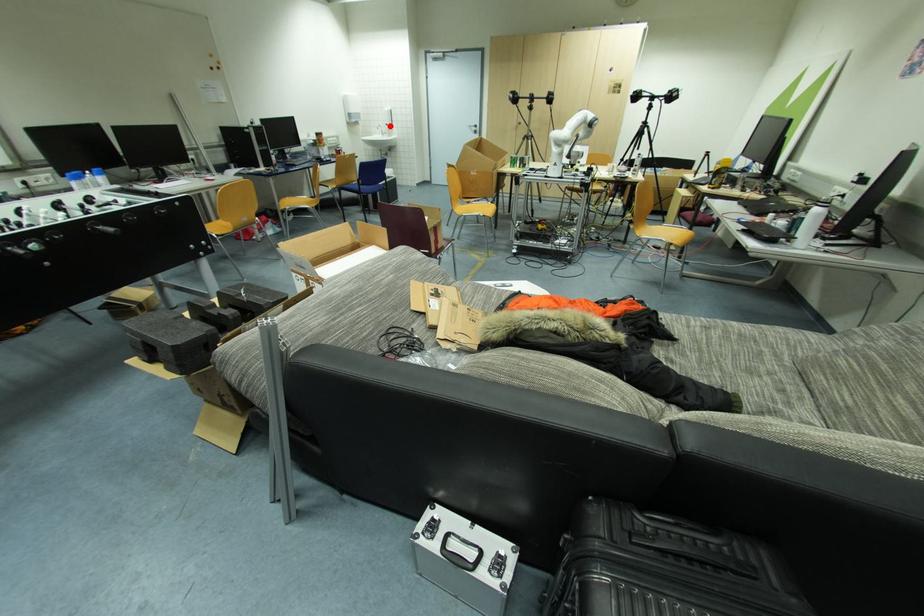
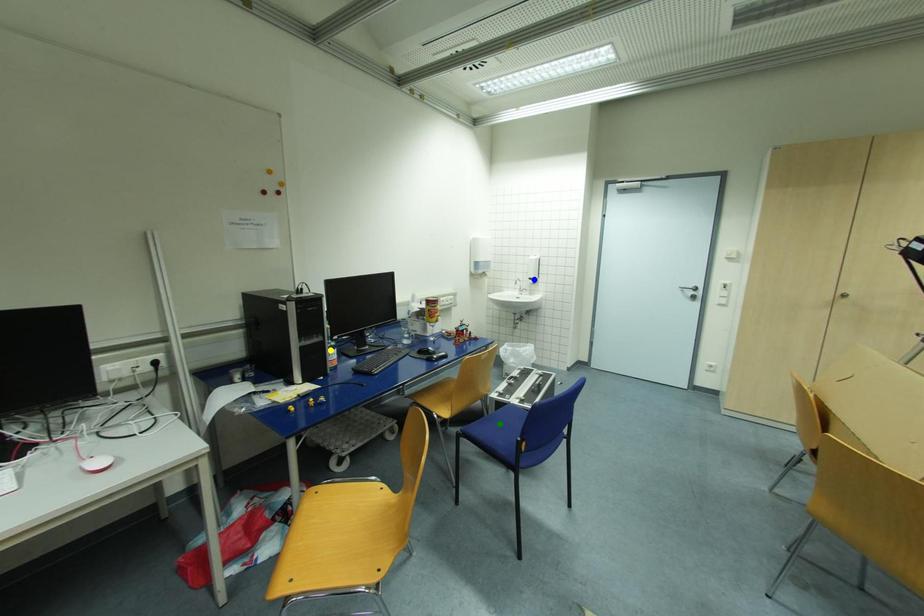
Question: I am providing you with two images of the same scene from different viewpoints. A red point is marked on the first image. You are given multiple points on the second image. In image 2, which mark is for the same physical point as the one in image 1?

Choices:
 (A) blue point
 (B) green point
 (C) yellow point

Answer: (A)